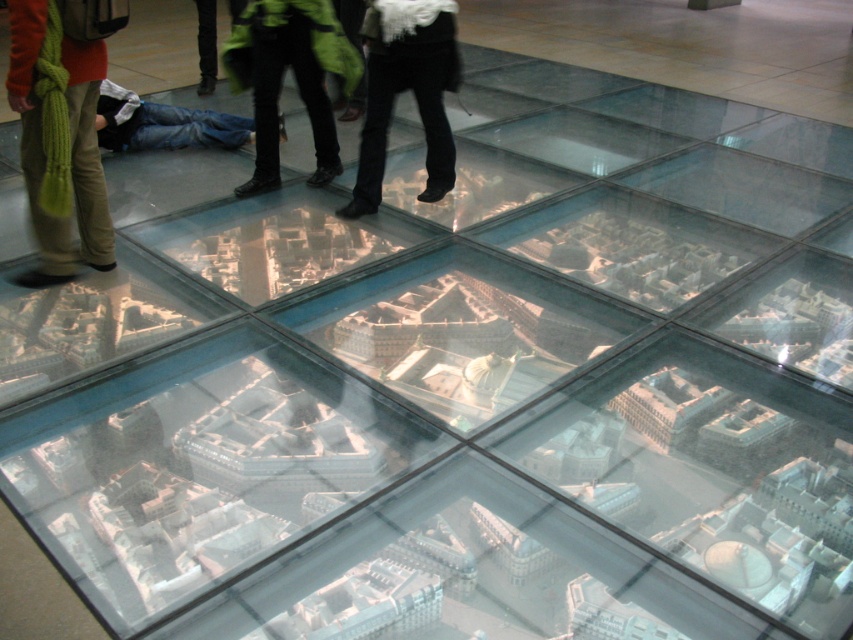
Question: Observing the image, what is the correct spatial positioning of black jeans at center in reference to denim jeans at lower left?

Choices:
 (A) left
 (B) right

Answer: (B)

Question: Which point is closer to the camera?

Choices:
 (A) (137, 97)
 (B) (265, 74)
 (C) (392, 4)

Answer: (C)

Question: Which point appears closest to the camera in this image?

Choices:
 (A) (339, 65)
 (B) (444, 141)
 (C) (107, 100)

Answer: (A)

Question: Is knitted green scarf at left thinner than green matte jacket at upper center?

Choices:
 (A) no
 (B) yes

Answer: (B)

Question: Which point appears closest to the camera in this image?

Choices:
 (A) (368, 140)
 (B) (45, 80)
 (C) (329, 16)
 (D) (114, 147)

Answer: (B)

Question: Is knitted green scarf at left below green matte jacket at upper center?

Choices:
 (A) yes
 (B) no

Answer: (A)